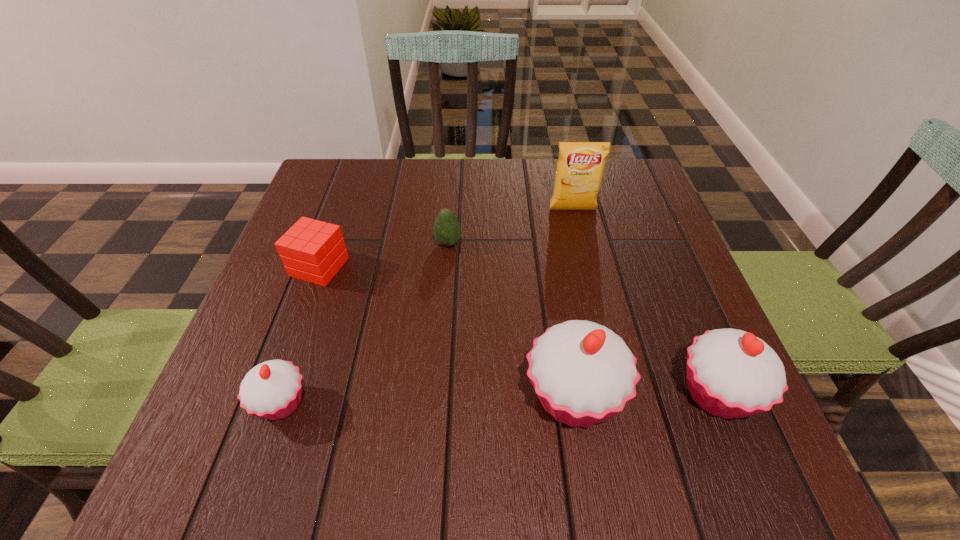
I want to click on object positioned at the near right corner, so click(x=731, y=373).

Identify the location of free region at the far edge. This screenshot has height=540, width=960. (453, 195).

In the image, there is a desktop. Identify the location of vacant space at the near edge. (374, 380).

Locate an element on the screen. vacant space at the left edge is located at coordinates (303, 367).

Where is `vacant region at the right edge of the desktop`? This screenshot has height=540, width=960. vacant region at the right edge of the desktop is located at coordinates (615, 240).

This screenshot has width=960, height=540. What are the coordinates of `free space at the far left corner of the desktop` in the screenshot? It's located at (359, 179).

Locate an element on the screen. This screenshot has height=540, width=960. free space at the far right corner is located at coordinates (619, 188).

I want to click on free area in between the avocado and the shortest cupcake, so (365, 323).

Locate an element on the screen. This screenshot has width=960, height=540. empty location between the fourth shortest object and the avocado is located at coordinates tap(583, 319).

Identify the location of empty location between the avocado and the cube. Image resolution: width=960 pixels, height=540 pixels. (384, 255).